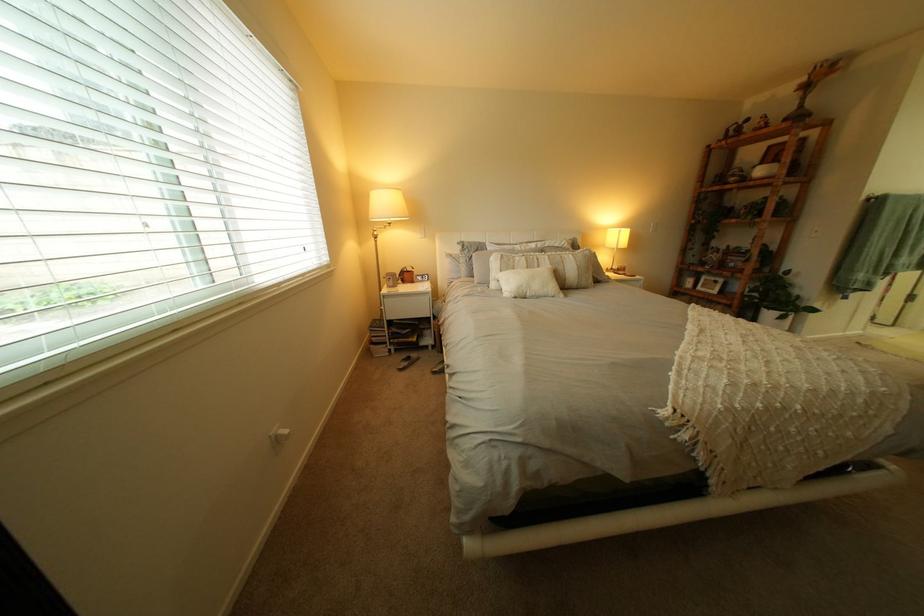
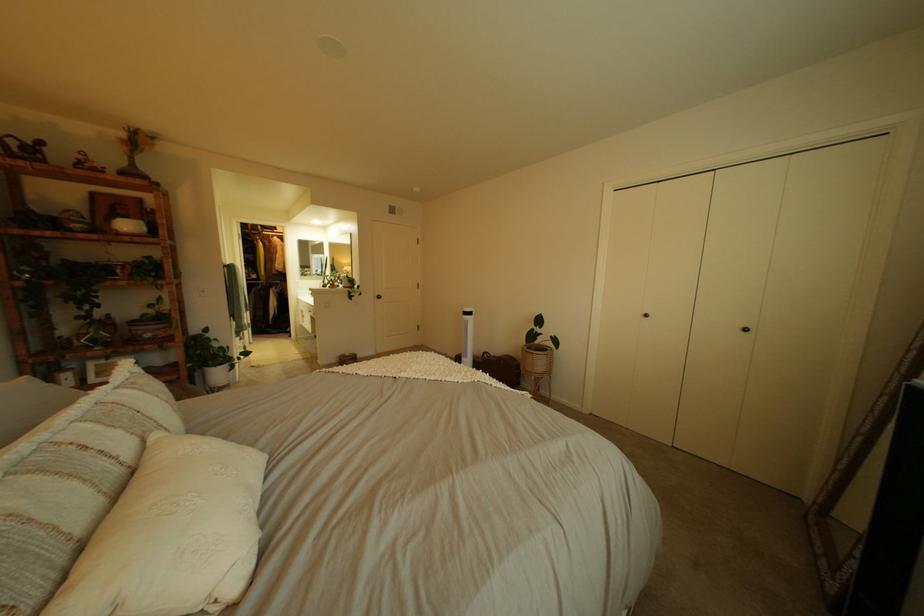
Find the pixel in the second image that matches point 767,179 in the first image.

(132, 232)